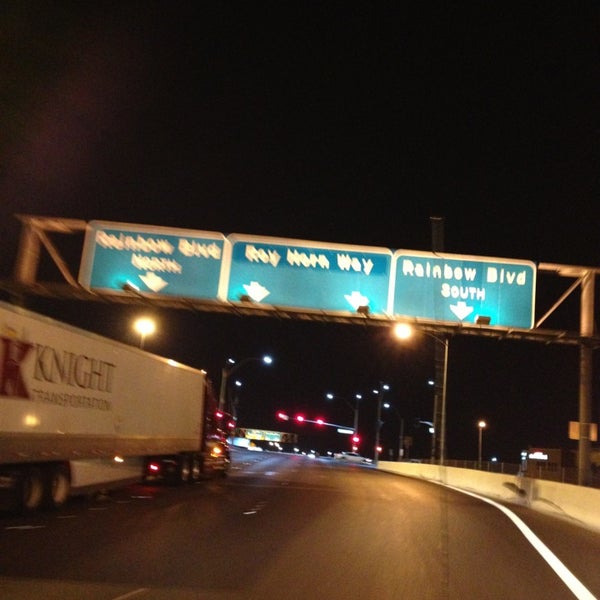
Locate an element on the screen. The height and width of the screenshot is (600, 600). blurry exit signs is located at coordinates (149, 262), (301, 266), (460, 286).